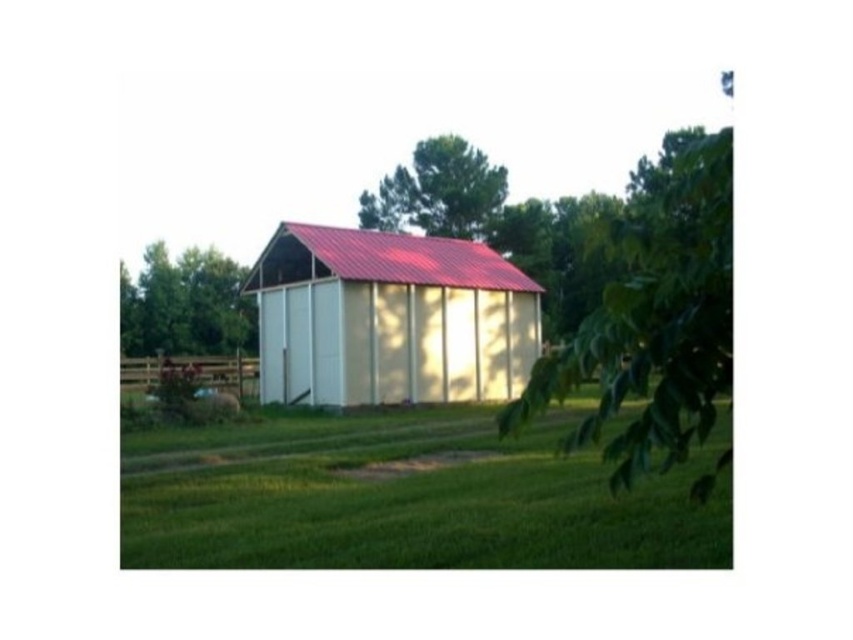
You are a gardener planning to plant a new tree in this area. Considering the green leafy tree at left and the green leafy tree at upper center, which one has a wider canopy to provide more shade?

The green leafy tree at left has a wider canopy than the green leafy tree at upper center, so it provides more shade.

You are standing at the entrance of the building and want to walk to both the point at coordinates (723, 324) and the point at (123, 305). Which point will you reach first?

You will reach point (723, 324) first because it is closer to the viewer than point (123, 305).

You are standing at the entrance of the red metal roof building and looking towards the green leafy tree at upper center. Which direction should you walk to reach the green leafy tree at center?

The green leafy tree at center is positioned under the green leafy tree at upper center, so you should walk forward towards the green leafy tree at upper center to reach the green leafy tree at center.